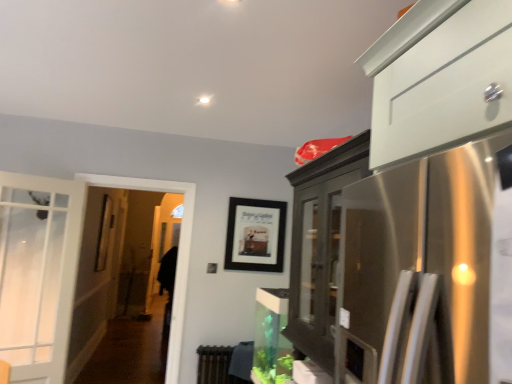
Question: Considering the relative sizes of brown textured radiator at lower center and black matte picture frame at center in the image provided, is brown textured radiator at lower center smaller than black matte picture frame at center?

Choices:
 (A) yes
 (B) no

Answer: (B)

Question: From a real-world perspective, is brown textured radiator at lower center physically below black matte picture frame at center?

Choices:
 (A) no
 (B) yes

Answer: (B)

Question: Is brown textured radiator at lower center with black matte picture frame at center?

Choices:
 (A) no
 (B) yes

Answer: (A)

Question: Considering the relative positions of brown textured radiator at lower center and black matte picture frame at center in the image provided, is brown textured radiator at lower center to the left of black matte picture frame at center from the viewer's perspective?

Choices:
 (A) no
 (B) yes

Answer: (B)

Question: From a real-world perspective, is brown textured radiator at lower center physically above black matte picture frame at center?

Choices:
 (A) no
 (B) yes

Answer: (A)

Question: Can we say brown textured radiator at lower center lies outside black matte picture frame at center?

Choices:
 (A) no
 (B) yes

Answer: (B)

Question: Considering the relative sizes of clear glass screen door at left and brown textured radiator at lower center in the image provided, is clear glass screen door at left taller than brown textured radiator at lower center?

Choices:
 (A) no
 (B) yes

Answer: (B)

Question: From a real-world perspective, is clear glass screen door at left over brown textured radiator at lower center?

Choices:
 (A) no
 (B) yes

Answer: (B)

Question: Is clear glass screen door at left looking in the opposite direction of brown textured radiator at lower center?

Choices:
 (A) yes
 (B) no

Answer: (B)

Question: Would you say brown textured radiator at lower center is part of clear glass screen door at left's contents?

Choices:
 (A) yes
 (B) no

Answer: (B)

Question: Does clear glass screen door at left appear on the right side of brown textured radiator at lower center?

Choices:
 (A) no
 (B) yes

Answer: (A)

Question: Does clear glass screen door at left have a larger size compared to brown textured radiator at lower center?

Choices:
 (A) yes
 (B) no

Answer: (A)

Question: Does black matte picture frame at center turn towards brown textured radiator at lower center?

Choices:
 (A) yes
 (B) no

Answer: (B)